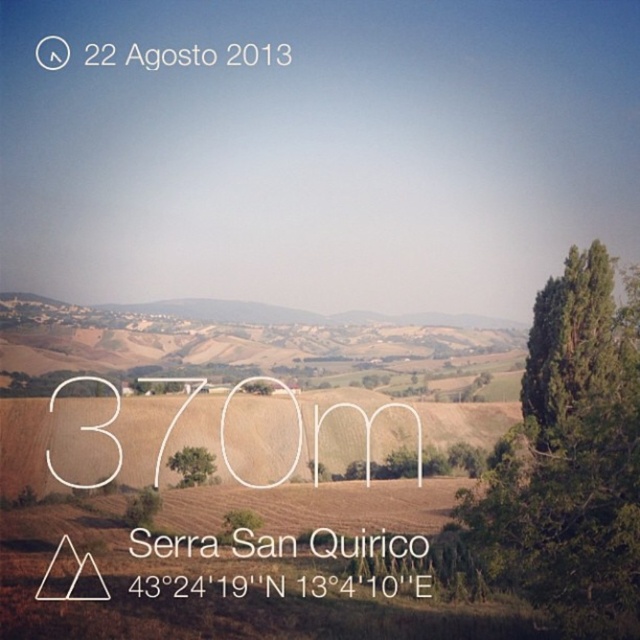
Does brown grassy hill at center have a larger size compared to green leafy tree at center?

Correct, brown grassy hill at center is larger in size than green leafy tree at center.

Measure the distance between point (58, 362) and camera.

The distance of point (58, 362) from camera is 71.94 feet.

Does point (17, 355) come farther from viewer compared to point (182, 451)?

Yes, point (17, 355) is behind point (182, 451).

Find the location of a particular element. brown grassy hill at center is located at coordinates (240, 340).

Between green leafy tree at right and brown grassy hill at center, which one appears on the left side from the viewer's perspective?

Positioned to the left is brown grassy hill at center.

Is green leafy tree at right above brown grassy hill at center?

Correct, green leafy tree at right is located above brown grassy hill at center.

What do you see at coordinates (572, 458) in the screenshot? I see `green leafy tree at right` at bounding box center [572, 458].

At what (x,y) coordinates should I click in order to perform the action: click on green leafy tree at right. Please return your answer as a coordinate pair (x, y). Looking at the image, I should click on (572, 458).

Is green leafy tree at right bigger than green leafy tree at center?

Incorrect, green leafy tree at right is not larger than green leafy tree at center.

Between green leafy tree at right and green leafy tree at center, which one is positioned lower?

green leafy tree at center is below.

Who is more distant from viewer, (509, 445) or (214, 460)?

The point (509, 445) is behind.

This screenshot has width=640, height=640. In order to click on green leafy tree at right in this screenshot , I will do `click(572, 458)`.